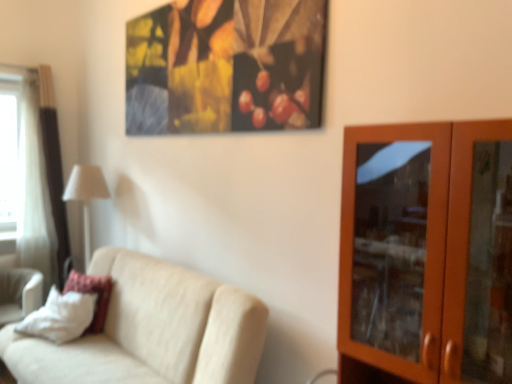
What are the coordinates of `white fabric swivel chair at lower left` in the screenshot? It's located at (19, 293).

What do you see at coordinates (151, 331) in the screenshot?
I see `beige fabric couch at lower left` at bounding box center [151, 331].

Find the location of a particular element. This screenshot has height=384, width=512. beige fabric couch at lower left is located at coordinates (151, 331).

Image resolution: width=512 pixels, height=384 pixels. Describe the element at coordinates (426, 253) in the screenshot. I see `brown wooden cabinet at right` at that location.

The height and width of the screenshot is (384, 512). Find the location of `white soft pillow at lower left`. white soft pillow at lower left is located at coordinates (91, 293).

Which is more to the left, brown wooden cabinet at right or white fabric swivel chair at lower left?

Positioned to the left is white fabric swivel chair at lower left.

Is brown wooden cabinet at right bigger or smaller than white fabric swivel chair at lower left?

Considering their sizes, brown wooden cabinet at right takes up more space than white fabric swivel chair at lower left.

Considering the positions of points (449, 267) and (35, 295), is point (449, 267) farther from camera compared to point (35, 295)?

No.

Relative to brown wooden cabinet at right, is beige fabric couch at lower left in front or behind?

beige fabric couch at lower left is behind brown wooden cabinet at right.

Is beige fabric couch at lower left positioned beyond the bounds of brown wooden cabinet at right?

beige fabric couch at lower left is positioned outside brown wooden cabinet at right.

Identify the location of dresser that is on the right side of beige fabric couch at lower left. The height and width of the screenshot is (384, 512). (426, 253).

Is brown wooden cabinet at right in front of or behind white soft pillow at lower left in the image?

In the image, brown wooden cabinet at right appears in front of white soft pillow at lower left.

Does point (507, 214) come in front of point (99, 308)?

Yes, point (507, 214) is closer to viewer.

Between brown wooden cabinet at right and white soft pillow at lower left, which one has larger width?

brown wooden cabinet at right is wider.

Is brown wooden cabinet at right not within white soft pillow at lower left?

Absolutely, brown wooden cabinet at right is external to white soft pillow at lower left.

Considering the positions of objects white soft pillow at lower left and white fabric lampshade at left in the image provided, who is more to the left, white soft pillow at lower left or white fabric lampshade at left?

From the viewer's perspective, white fabric lampshade at left appears more on the left side.

Is white fabric lampshade at left completely or partially inside white soft pillow at lower left?

No, white fabric lampshade at left is not inside white soft pillow at lower left.

Looking at their sizes, would you say white soft pillow at lower left is wider or thinner than white fabric lampshade at left?

white soft pillow at lower left is thinner than white fabric lampshade at left.

Does white soft pillow at lower left turn towards white fabric lampshade at left?

No.

Does white sheer curtain at left appear on the left side of white fabric swivel chair at lower left?

Yes, white sheer curtain at left is to the left of white fabric swivel chair at lower left.

Considering the relative sizes of white sheer curtain at left and white fabric swivel chair at lower left in the image provided, is white sheer curtain at left bigger than white fabric swivel chair at lower left?

Correct, white sheer curtain at left is larger in size than white fabric swivel chair at lower left.

From a real-world perspective, is white sheer curtain at left located higher than white fabric swivel chair at lower left?

Yes.

Can you confirm if white sheer curtain at left is thinner than white fabric swivel chair at lower left?

Correct, the width of white sheer curtain at left is less than that of white fabric swivel chair at lower left.

Is point (103, 277) closer or farther from the camera than point (168, 330)?

Point (103, 277) is positioned farther from the camera compared to point (168, 330).

Relative to beige fabric couch at lower left, is white soft pillow at lower left in front or behind?

In the image, white soft pillow at lower left appears behind beige fabric couch at lower left.

In the scene shown: Is white soft pillow at lower left oriented towards beige fabric couch at lower left?

Yes, white soft pillow at lower left is facing beige fabric couch at lower left.

From the image's perspective, is brown wooden cabinet at right above or below white sheer curtain at left?

brown wooden cabinet at right is situated lower than white sheer curtain at left in the image.

Considering the sizes of objects brown wooden cabinet at right and white sheer curtain at left in the image provided, who is wider, brown wooden cabinet at right or white sheer curtain at left?

brown wooden cabinet at right.

Is white sheer curtain at left at the back of brown wooden cabinet at right?

brown wooden cabinet at right is not turned away from white sheer curtain at left.

In order to click on swivel chair below the brown wooden cabinet at right (from the image's perspective) in this screenshot , I will do `click(19, 293)`.

Image resolution: width=512 pixels, height=384 pixels. What are the coordinates of `studio couch located on the left of brown wooden cabinet at right` in the screenshot? It's located at (151, 331).

Considering their positions, is brown wooden cabinet at right positioned further to white sheer curtain at left than beige fabric couch at lower left?

The object further to white sheer curtain at left is brown wooden cabinet at right.

When comparing their distances from beige fabric couch at lower left, does white fabric swivel chair at lower left or white fabric lampshade at left seem closer?

white fabric swivel chair at lower left.

Considering their positions, is white sheer curtain at left positioned closer to white fabric swivel chair at lower left than white soft pillow at lower left?

white soft pillow at lower left lies closer to white fabric swivel chair at lower left than the other object.

When comparing their distances from white fabric lampshade at left, does white sheer curtain at left or white fabric swivel chair at lower left seem further?

white fabric swivel chair at lower left.

Which object lies further to the anchor point beige fabric couch at lower left, white sheer curtain at left or white fabric lampshade at left?

Among the two, white sheer curtain at left is located further to beige fabric couch at lower left.

From the image, which object appears to be nearer to white fabric swivel chair at lower left, brown wooden cabinet at right or white sheer curtain at left?

white sheer curtain at left is closer to white fabric swivel chair at lower left.

Considering their positions, is white fabric swivel chair at lower left positioned closer to beige fabric couch at lower left than white sheer curtain at left?

white fabric swivel chair at lower left is positioned closer to the anchor beige fabric couch at lower left.

Based on their spatial positions, is white soft pillow at lower left or brown wooden cabinet at right closer to white sheer curtain at left?

Among the two, white soft pillow at lower left is located nearer to white sheer curtain at left.

This screenshot has height=384, width=512. Find the location of `studio couch between brown wooden cabinet at right and white fabric lampshade at left from front to back`. studio couch between brown wooden cabinet at right and white fabric lampshade at left from front to back is located at coordinates (151, 331).

In order to click on swivel chair positioned between beige fabric couch at lower left and white fabric lampshade at left from near to far in this screenshot , I will do `click(19, 293)`.

The width and height of the screenshot is (512, 384). I want to click on studio couch between white fabric swivel chair at lower left and brown wooden cabinet at right in the horizontal direction, so click(x=151, y=331).

Where is `studio couch situated between white soft pillow at lower left and brown wooden cabinet at right from left to right`? studio couch situated between white soft pillow at lower left and brown wooden cabinet at right from left to right is located at coordinates (151, 331).